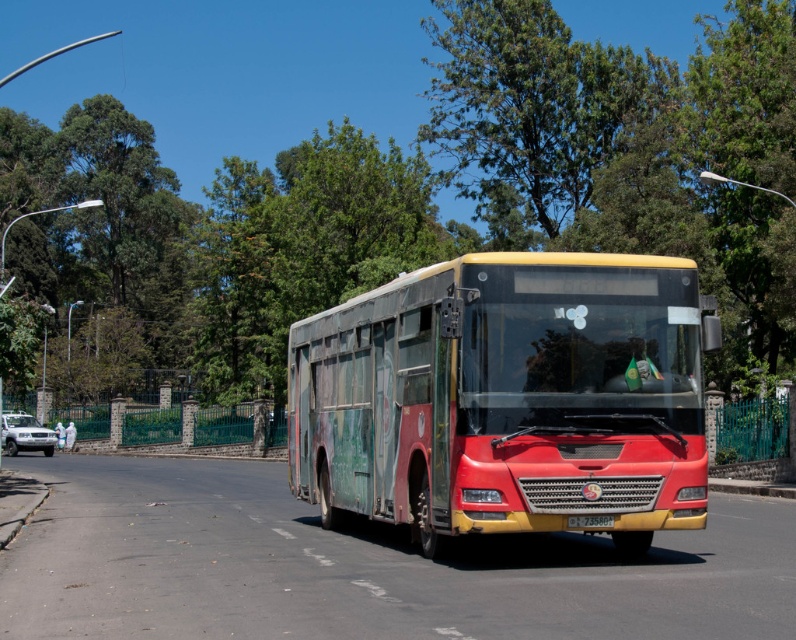
Question: Is green leafy tree at upper center bigger than metallic silver suv at lower left?

Choices:
 (A) yes
 (B) no

Answer: (A)

Question: Can you confirm if green leafy tree at upper center is wider than metallic silver suv at lower left?

Choices:
 (A) yes
 (B) no

Answer: (A)

Question: Which object is the farthest from the yellow matte license plate at center?

Choices:
 (A) rusty metal bus at center
 (B) green leafy tree at upper center

Answer: (B)

Question: Which object appears closest to the camera in this image?

Choices:
 (A) metallic silver suv at lower left
 (B) green leafy tree at upper center
 (C) yellow matte license plate at center

Answer: (C)

Question: Does rusty metal bus at center have a larger size compared to metallic silver suv at lower left?

Choices:
 (A) yes
 (B) no

Answer: (B)

Question: Which object is the closest to the yellow matte license plate at center?

Choices:
 (A) rusty metal bus at center
 (B) metallic silver suv at lower left

Answer: (A)